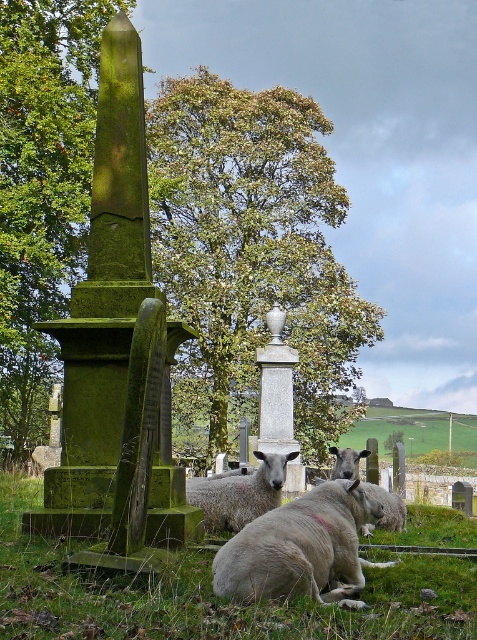
The height and width of the screenshot is (640, 477). What do you see at coordinates (251, 252) in the screenshot?
I see `green leafy tree at center` at bounding box center [251, 252].

Can you confirm if green leafy tree at center is thinner than green grassy at center?

No, green leafy tree at center is not thinner than green grassy at center.

Which is in front, point (267, 259) or point (100, 634)?

Point (100, 634) is more forward.

At what (x,y) coordinates should I click in order to perform the action: click on green leafy tree at center. Please return your answer as a coordinate pair (x, y). Looking at the image, I should click on coord(251,252).

Between green leafy tree at center and fuzzy woolly sheep at center, which one is positioned lower?

fuzzy woolly sheep at center is lower down.

Is point (218, 435) more distant than point (262, 465)?

Yes, it is behind point (262, 465).

In order to click on green leafy tree at center in this screenshot , I will do `click(251, 252)`.

In order to click on green leafy tree at center in this screenshot , I will do coord(251,252).

Is green mossy stone obelisk at left to the right of green grassy at center from the viewer's perspective?

In fact, green mossy stone obelisk at left is to the left of green grassy at center.

Is point (45, 136) less distant than point (9, 586)?

No, it is behind (9, 586).

Who is more forward, [11,40] or [177,579]?

Point [177,579] is in front.

Locate an element on the screen. The image size is (477, 640). green mossy stone obelisk at left is located at coordinates (42, 189).